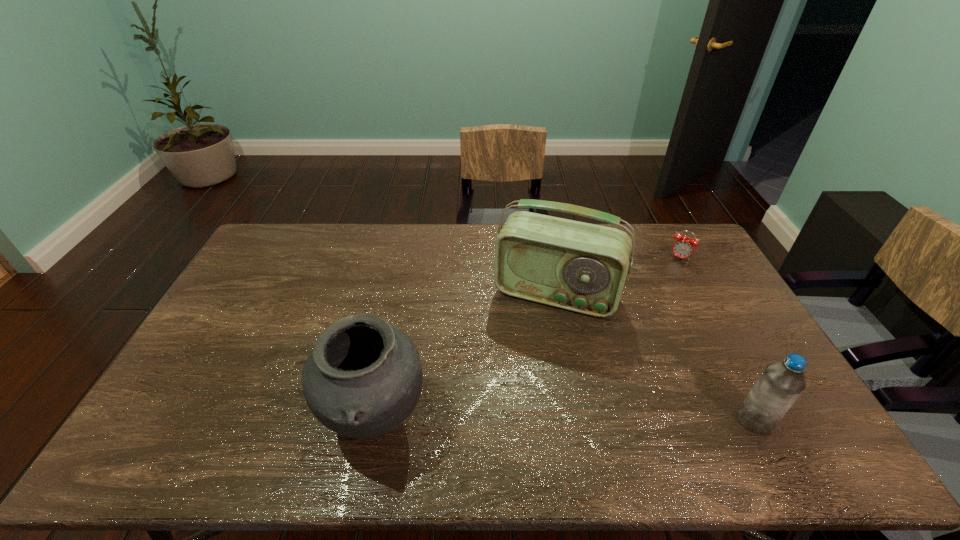
In order to click on vacant region between the second farthest object and the leftmost object in this screenshot , I will do `click(466, 357)`.

At what (x,y) coordinates should I click in order to perform the action: click on empty space between the leftmost object and the alarm clock. Please return your answer as a coordinate pair (x, y). The height and width of the screenshot is (540, 960). Looking at the image, I should click on (528, 339).

This screenshot has height=540, width=960. Identify the location of blank region between the second shortest object and the alarm clock. (x=717, y=339).

Where is `vacant area between the water bottle and the second object from left to right`? Image resolution: width=960 pixels, height=540 pixels. vacant area between the water bottle and the second object from left to right is located at coordinates (656, 357).

This screenshot has width=960, height=540. Find the location of `free space that is in between the alarm clock and the water bottle`. free space that is in between the alarm clock and the water bottle is located at coordinates click(x=717, y=339).

Point out which object is positioned as the nearest to the shortest object. Please provide its 2D coordinates. Your answer should be formatted as a tuple, i.e. [(x, y)], where the tuple contains the x and y coordinates of a point satisfying the conditions above.

[(582, 267)]

Identify which object is the closest to the radio receiver. Please provide its 2D coordinates. Your answer should be formatted as a tuple, i.e. [(x, y)], where the tuple contains the x and y coordinates of a point satisfying the conditions above.

[(683, 247)]

Identify the location of vacant region that satisfies the following two spatial constraints: 1. on the back side of the water bottle; 2. on the left side of the shortest object. (671, 258).

At what (x,y) coordinates should I click in order to perform the action: click on vacant space that satisfies the following two spatial constraints: 1. on the back side of the third shortest object; 2. on the right side of the alarm clock. Please return your answer as a coordinate pair (x, y). The image size is (960, 540). Looking at the image, I should click on (408, 258).

Find the location of a particular element. The width and height of the screenshot is (960, 540). vacant space that satisfies the following two spatial constraints: 1. on the back side of the leftmost object; 2. on the left side of the farthest object is located at coordinates (408, 258).